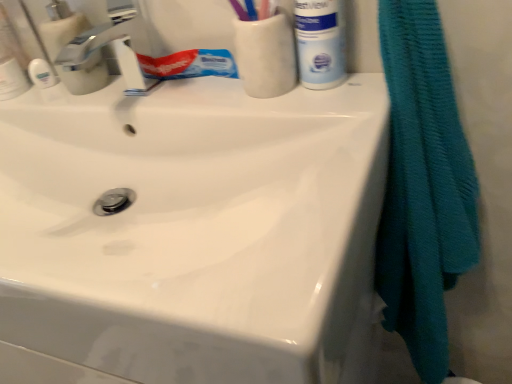
I want to click on vacant area that is in front of white matte mouthwash at upper right, so click(x=339, y=126).